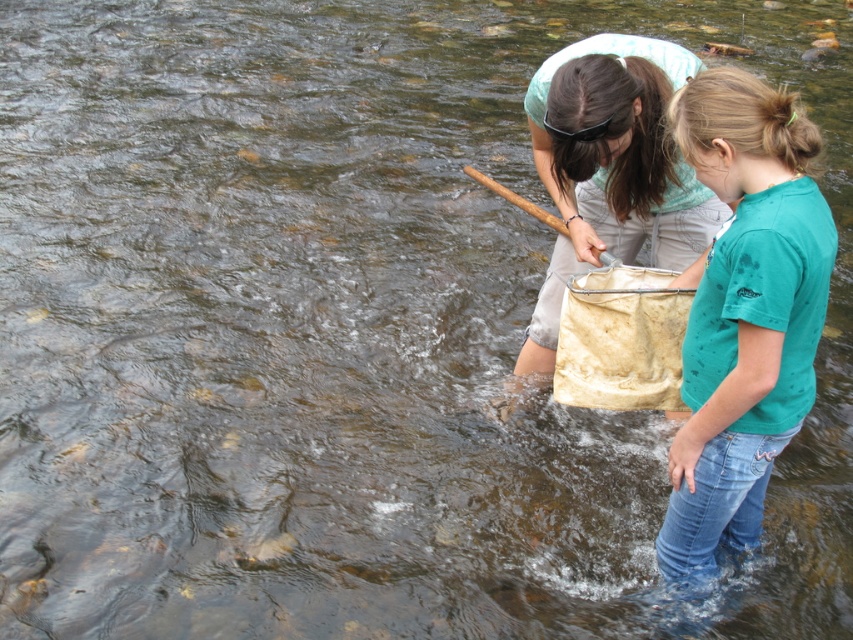
From the picture: Does teal matte shirt at right have a lesser width compared to light blue fabric net at center?

Yes.

Who is taller, teal matte shirt at right or light blue fabric net at center?

With more height is teal matte shirt at right.

Is point (692, 570) positioned before point (610, 179)?

Yes, it is.

Find the location of a particular element. The height and width of the screenshot is (640, 853). teal matte shirt at right is located at coordinates (744, 314).